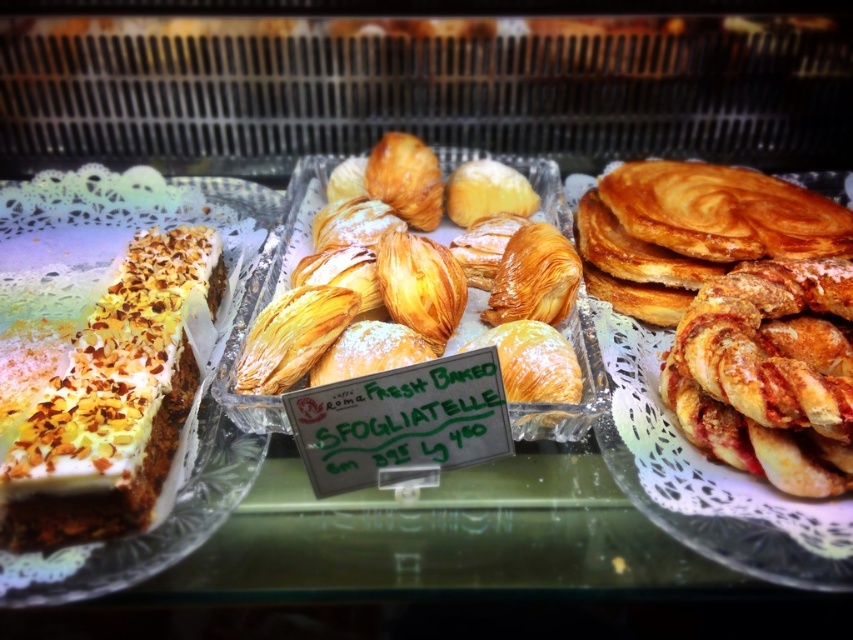
You are a customer at a bakery and want to choose between the white cream topped with nuts at center and the golden flaky pastry at center. Which one is placed above the other in the display case?

The golden flaky pastry at center is placed above the white cream topped with nuts at center because the description states that the white cream topped with nuts at center is positioned under the golden flaky pastry at center.

You are a customer at a bakery and want to choose between the swirled golden pancake at right and the golden crispy pastry at right. Which one is bigger?

The swirled golden pancake at right is larger in size compared to the golden crispy pastry at right.

You are a customer at the bakery and want to buy the swirled golden pancake at right. Where should you look in the display case?

The swirled golden pancake at right is located at point (723, 211) in the display case, so you should look towards the right side near the bottom to find it.